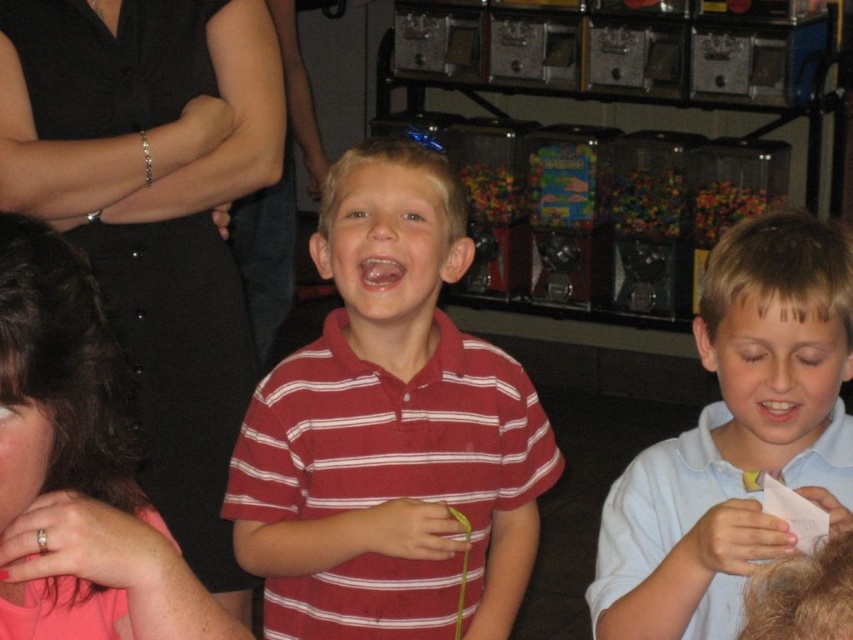
Can you confirm if translucent plastic gumballs at center is wider than translucent plastic candy at center?

Incorrect, translucent plastic gumballs at center's width does not surpass translucent plastic candy at center's.

Is point (630, 208) positioned in front of point (709, 205)?

That is False.

Describe the element at coordinates (648, 202) in the screenshot. I see `translucent plastic gumballs at center` at that location.

Find the location of a particular element. This screenshot has height=640, width=853. translucent plastic gumballs at center is located at coordinates (648, 202).

Who is more distant from viewer, (753, 465) or (163, 536)?

Positioned behind is point (753, 465).

Does white cotton shirt at right have a larger size compared to pink matte shirt at lower left?

Yes.

Which is behind, point (722, 481) or point (165, 586)?

The point (722, 481) is more distant.

At what (x,y) coordinates should I click in order to perform the action: click on white cotton shirt at right. Please return your answer as a coordinate pair (x, y). Looking at the image, I should click on (737, 436).

Can you confirm if striped cotton shirt at center is taller than translucent plastic candy at center?

Yes.

From the picture: Which is above, striped cotton shirt at center or translucent plastic candy at center?

Positioned higher is translucent plastic candy at center.

Find the location of a particular element. This screenshot has width=853, height=640. striped cotton shirt at center is located at coordinates (390, 432).

Locate an element on the screen. striped cotton shirt at center is located at coordinates (390, 432).